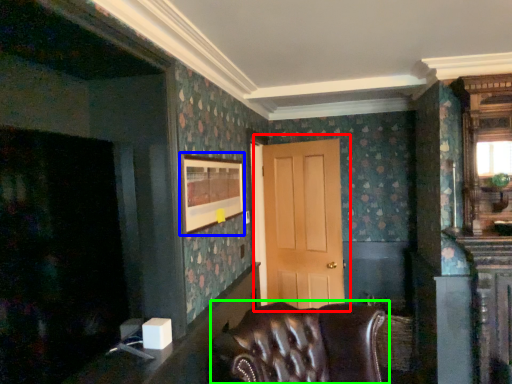
Question: Which object is positioned closest to door (highlighted by a red box)? Select from picture frame (highlighted by a blue box) and chair (highlighted by a green box).

Choices:
 (A) picture frame
 (B) chair

Answer: (A)